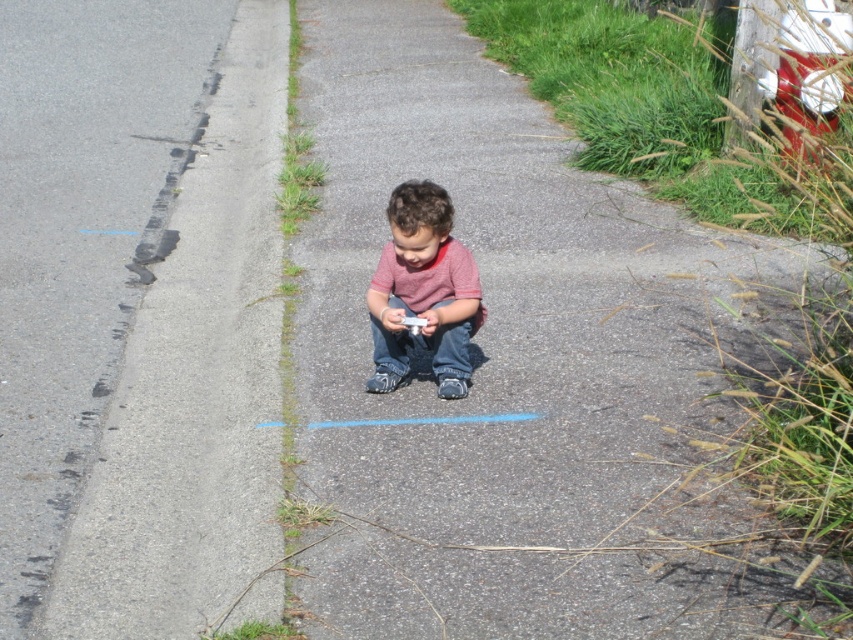
You are taking a photo of the child and notice two points marked on the pavement. The first point is at coordinates point (180, 557) and the second is at point (416, 205). Which point appears closer to you in the photo?

Point (180, 557) is closer to the camera than point (416, 205), so it appears closer in the photo.

You are a photographer taking a picture of the child. You notice two points marked on the pavement near the child. The first point is at coordinates point (329, 288) and the second is at point (207, 616). Which point should you focus on to ensure the child remains in sharp focus?

You should focus on point (329, 288) because it is closer to the camera than point (207, 616). Since the child is sitting on the pavement, focusing on the closer point will keep the child in focus.

You are a parent looking for your child who is wearing a pink shirt. You see the gray asphalt at lower left and the matte pink shirt at center in the image. Based on their positions, where would you expect to find the child relative to the gray asphalt?

The gray asphalt at lower left is located above the matte pink shirt at center, meaning the matte pink shirt at center is below the gray asphalt at lower left. Therefore, the child wearing the matte pink shirt at center would be positioned below the gray asphalt at lower left.